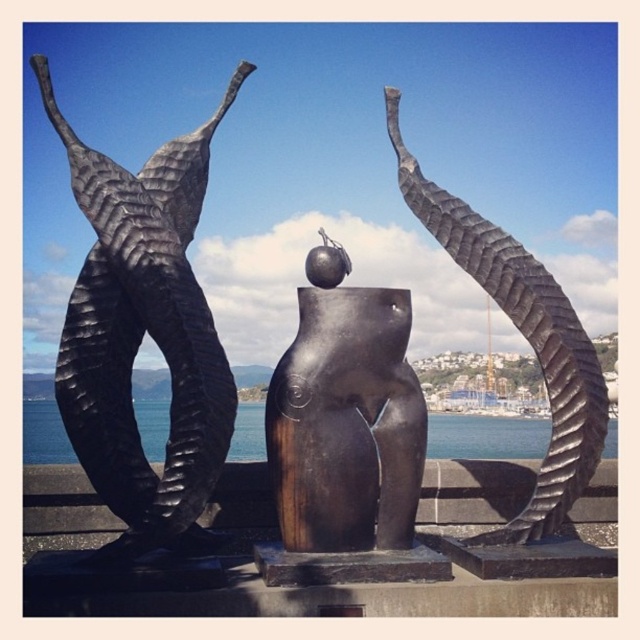
How distant is matte black sculpture at left from blue water at center?

matte black sculpture at left is 37.63 meters away from blue water at center.

Between matte black sculpture at left and blue water at center, which one is positioned lower?

Positioned lower is blue water at center.

Based on the photo, measure the distance between matte black sculpture at left and camera.

The distance of matte black sculpture at left from camera is 47.87 meters.

Identify the location of matte black sculpture at left. The image size is (640, 640). (141, 337).

Can you confirm if bronze matte torso at center is positioned below blue water at center?

No, bronze matte torso at center is not below blue water at center.

Measure the distance between bronze matte torso at center and camera.

bronze matte torso at center is 51.46 meters from camera.

Locate an element on the screen. bronze matte torso at center is located at coordinates (346, 417).

This screenshot has width=640, height=640. In order to click on bronze matte torso at center in this screenshot , I will do `click(346, 417)`.

Can you confirm if matte black sculpture at left is bigger than polished bronze sculpture at center?

Actually, matte black sculpture at left might be smaller than polished bronze sculpture at center.

Does point (170, 492) lie in front of point (570, 385)?

Yes, point (170, 492) is in front of point (570, 385).

The width and height of the screenshot is (640, 640). Find the location of `matte black sculpture at left`. matte black sculpture at left is located at coordinates (141, 337).

What are the coordinates of `matte black sculpture at left` in the screenshot? It's located at (141, 337).